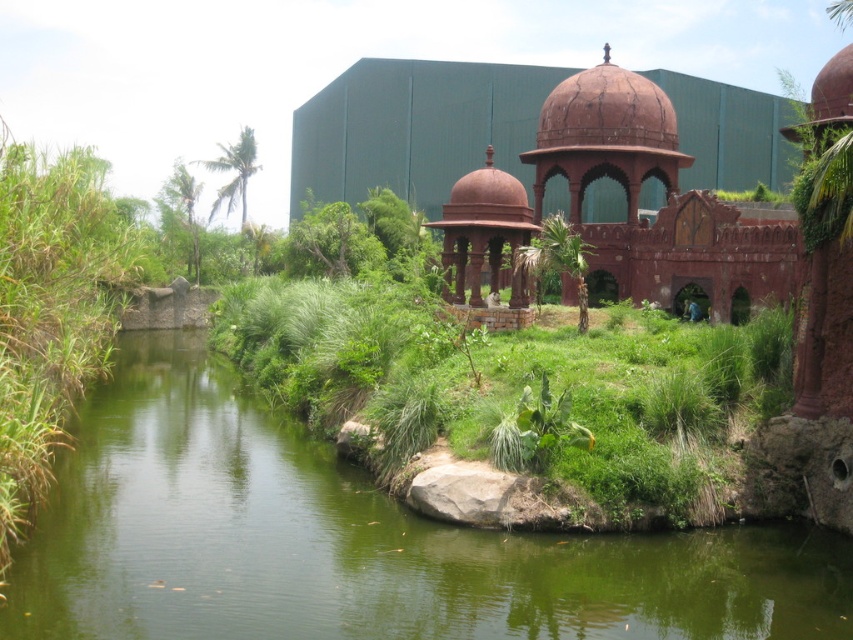
Question: Which point is closer to the camera?

Choices:
 (A) (589, 248)
 (B) (166, 484)

Answer: (B)

Question: Does rustic terracotta gazebo at center have a lesser width compared to rustic stone gazebo at center?

Choices:
 (A) no
 (B) yes

Answer: (A)

Question: Which of the following is the closest to the observer?

Choices:
 (A) (474, 262)
 (B) (206, 348)

Answer: (A)

Question: Does green grassy stream at center appear on the right side of rustic terracotta gazebo at center?

Choices:
 (A) yes
 (B) no

Answer: (B)

Question: Which point appears farthest from the camera in this image?

Choices:
 (A) (480, 193)
 (B) (599, 109)

Answer: (B)

Question: Is green grassy stream at center thinner than rustic stone gazebo at center?

Choices:
 (A) no
 (B) yes

Answer: (A)